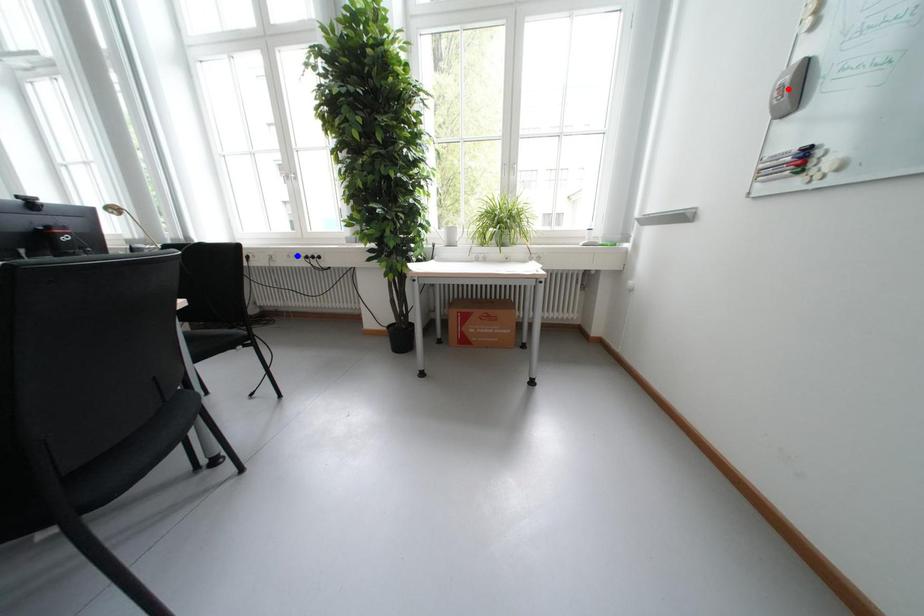
Question: Two points are marked on the image. Which point is closer to the camera?

Choices:
 (A) Blue point is closer.
 (B) Red point is closer.

Answer: (B)